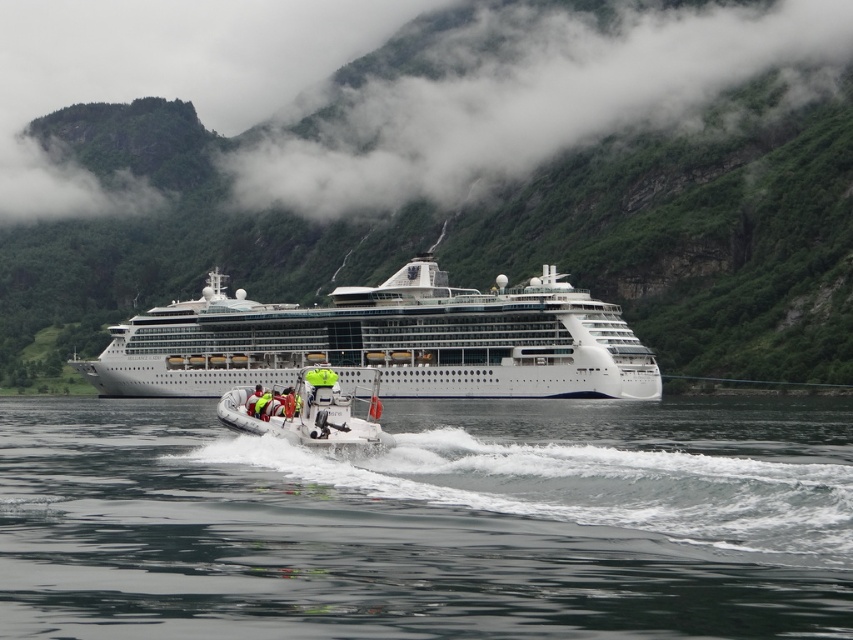
You are standing on the cruise ship and want to determine which of the two points, point (461, 616) or point (347, 404), is closer to you. Based on the scene, which point is nearer?

Point (461, 616) is closer to the viewer than point (347, 404).

You are a drone operator trying to capture a photo of the cruise ship and the motorboat. The drone is currently hovering at point coordinates of 0.5, 0.5. To frame the clear water at center properly, should you move the drone north or south? Please provide the answer based on the coordinates provided in the Objects Description.

The clear water at center is located at point (428, 522), which is north of the drone at (426, 320). Therefore, you should move the drone north to frame the clear water at center properly.